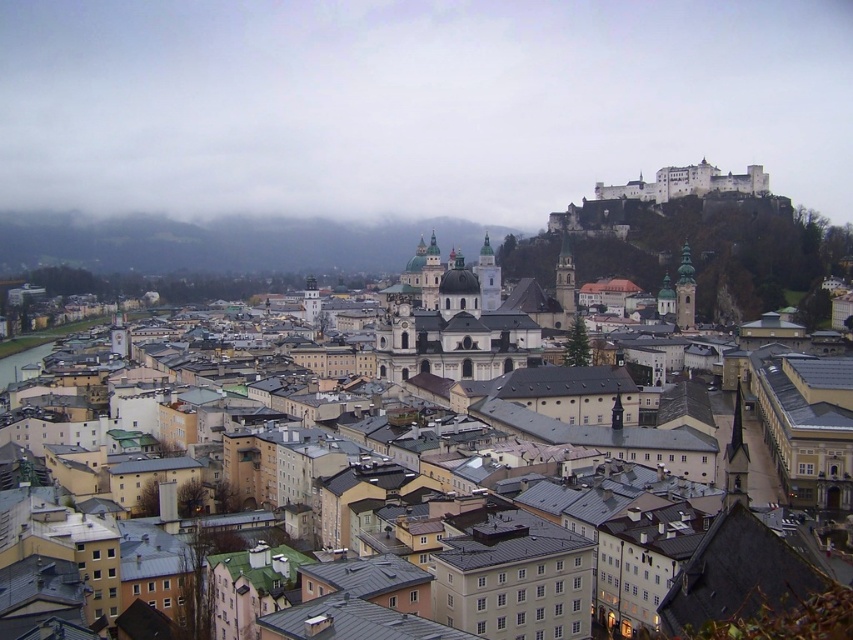
Question: Which of the following is the farthest from the observer?

Choices:
 (A) white stone church at center
 (B) brown textured buildings at center

Answer: (A)

Question: Which of these objects is positioned farthest from the white stone castle at upper right?

Choices:
 (A) brown textured buildings at center
 (B) white stone church at center

Answer: (A)

Question: Among these objects, which one is farthest from the camera?

Choices:
 (A) brown textured buildings at center
 (B) white stone castle at upper right
 (C) white stone church at center

Answer: (B)

Question: Is white stone church at center above white stone castle at upper right?

Choices:
 (A) yes
 (B) no

Answer: (B)

Question: Can you confirm if white stone church at center is thinner than white stone castle at upper right?

Choices:
 (A) no
 (B) yes

Answer: (B)

Question: Does white stone church at center have a smaller size compared to white stone castle at upper right?

Choices:
 (A) no
 (B) yes

Answer: (A)